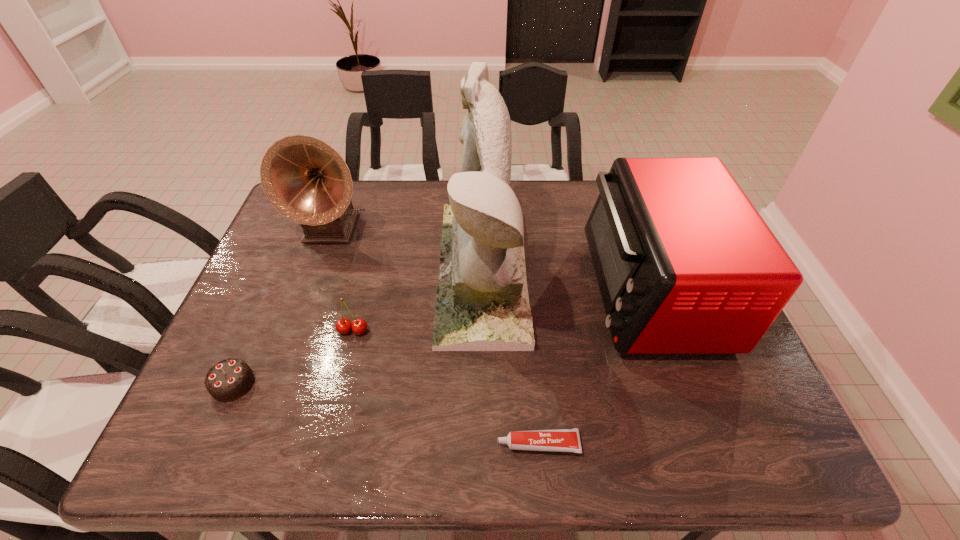
Locate an element on the screen. the tallest object is located at coordinates (482, 304).

The image size is (960, 540). What are the coordinates of `phonograph record` in the screenshot? It's located at (306, 180).

Identify the location of toaster oven. This screenshot has width=960, height=540. (685, 264).

The width and height of the screenshot is (960, 540). Find the location of `the rightmost object`. the rightmost object is located at coordinates (685, 264).

This screenshot has height=540, width=960. I want to click on cherry, so click(x=359, y=326).

The image size is (960, 540). Find the location of `the second shortest object`. the second shortest object is located at coordinates (229, 379).

What are the coordinates of `chocolate cake` in the screenshot? It's located at (229, 379).

Locate an element on the screen. toothpaste is located at coordinates (560, 440).

Image resolution: width=960 pixels, height=540 pixels. I want to click on the shortest object, so click(x=560, y=440).

Identify the location of free space located 0.210m on the base of the tallest object. (363, 272).